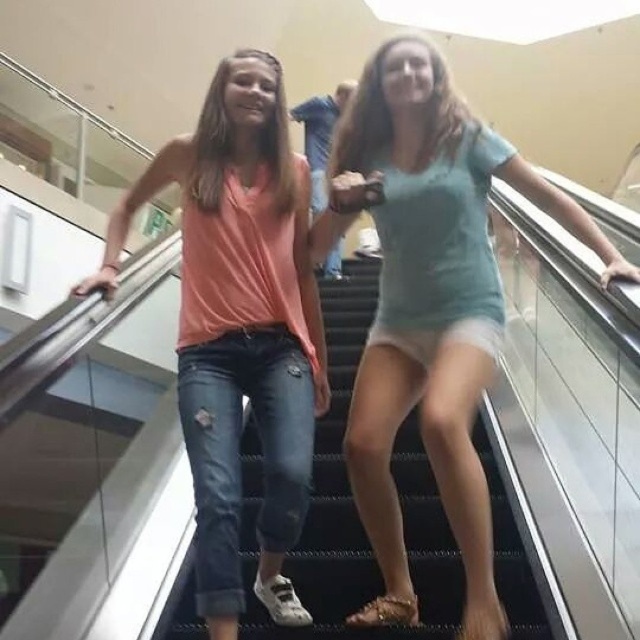
You are standing at the bottom of the escalator and want to know where the light blue fabric shorts at center are located. Can you describe their position relative to the center of the escalator?

The light blue fabric shorts at center are located at point 0.478 on the horizontal axis and 0.672 on the vertical axis relative to the center of the escalator.

You are standing at the base of the escalator in the mall and want to reach the top. There is a point marked at coordinates [275,218] on the escalator. If you start walking towards this point from your current position, will you be able to reach it before the escalator moves you past it?

The point at [275,218] is 1.69 meters away from you. Since escalators move at a constant speed, you need to consider your walking speed and the escalator speed to determine if you can reach it in time. Without specific speed values, it is impossible to confirm.